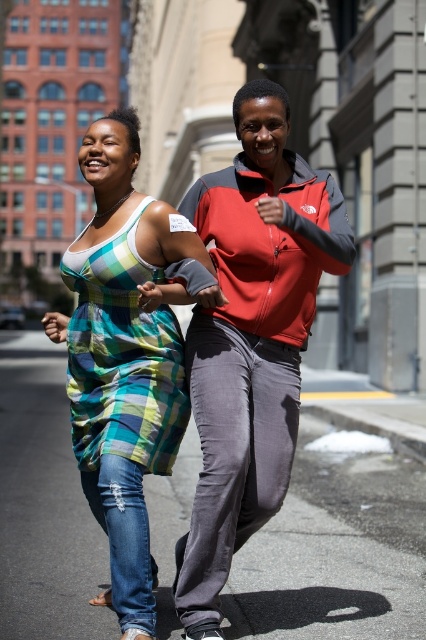
You are a photographer standing at the starting line of a race. You notice two runners wearing plaid dresses. The first runner is wearing a plaid fabric dress at center, and the second runner is wearing a plaid cotton dress at left. Which runner is closer to you?

The plaid fabric dress at center is located above the plaid cotton dress at left, meaning the runner wearing the plaid fabric dress at center is closer to you.

You are planning to place a small marker on the gray asphalt at center for a running event. According to the image, what are the coordinates where you should place the marker?

The gray asphalt at center is located at point [328,566], so you should place the marker at those coordinates.

You are standing at the point labeled as point (x=46, y=628) and want to greet someone who is exactly 15 feet away from you. Can you reach them without moving?

The distance between you and the viewer is 13.57 feet, which is less than 15 feet. Therefore, you cannot reach them without moving as you are closer than required.